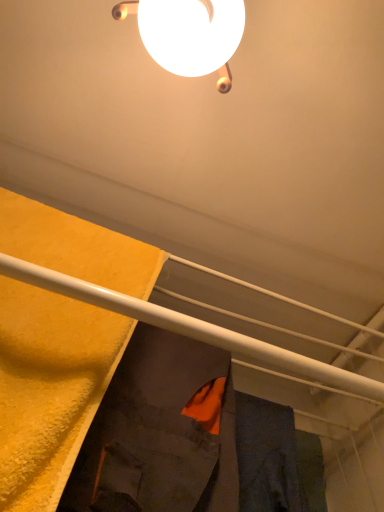
Question: Can you confirm if orange fabric at center, marked as the first robe in a right-to-left arrangement, is smaller than white glossy lamp at upper center?

Choices:
 (A) yes
 (B) no

Answer: (B)

Question: Can you confirm if orange fabric at center, the second robe positioned from the left, is wider than white glossy lamp at upper center?

Choices:
 (A) yes
 (B) no

Answer: (B)

Question: Does orange fabric at center, the second robe positioned from the left, contain white glossy lamp at upper center?

Choices:
 (A) yes
 (B) no

Answer: (B)

Question: Is orange fabric at center, marked as the first robe in a right-to-left arrangement, at the right side of white glossy lamp at upper center?

Choices:
 (A) yes
 (B) no

Answer: (A)

Question: From the image's perspective, is orange fabric at center, the second robe positioned from the left, located above white glossy lamp at upper center?

Choices:
 (A) yes
 (B) no

Answer: (B)

Question: From their relative heights in the image, would you say dark gray fabric robe at center, the 2th robe from the right, is taller or shorter than white glossy lamp at upper center?

Choices:
 (A) short
 (B) tall

Answer: (B)

Question: Looking at their shapes, would you say dark gray fabric robe at center, the 2th robe from the right, is wider or thinner than white glossy lamp at upper center?

Choices:
 (A) thin
 (B) wide

Answer: (A)

Question: Visually, is dark gray fabric robe at center, the 2th robe from the right, positioned to the left or to the right of white glossy lamp at upper center?

Choices:
 (A) right
 (B) left

Answer: (B)

Question: Is dark gray fabric robe at center, the 2th robe from the right, spatially inside white glossy lamp at upper center, or outside of it?

Choices:
 (A) inside
 (B) outside

Answer: (B)

Question: From a real-world perspective, relative to orange fabric at center, the second robe positioned from the left, is dark gray fabric robe at center, which is counted as the 1th robe, starting from the left, vertically above or below?

Choices:
 (A) above
 (B) below

Answer: (B)

Question: In terms of height, does dark gray fabric robe at center, the 2th robe from the right, look taller or shorter compared to orange fabric at center, marked as the first robe in a right-to-left arrangement?

Choices:
 (A) tall
 (B) short

Answer: (A)

Question: Would you say dark gray fabric robe at center, the 2th robe from the right, is inside or outside orange fabric at center, marked as the first robe in a right-to-left arrangement?

Choices:
 (A) outside
 (B) inside

Answer: (A)

Question: Does point (132, 428) appear closer or farther from the camera than point (243, 413)?

Choices:
 (A) farther
 (B) closer

Answer: (B)

Question: Based on their sizes in the image, would you say orange fabric at center, the second robe positioned from the left, is bigger or smaller than white glossy lamp at upper center?

Choices:
 (A) small
 (B) big

Answer: (B)

Question: Is point (281, 497) closer or farther from the camera than point (213, 64)?

Choices:
 (A) farther
 (B) closer

Answer: (A)